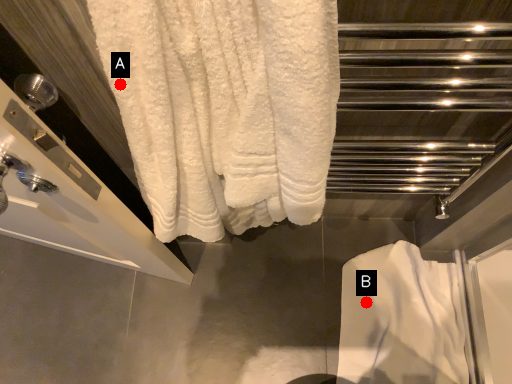
Question: Two points are circled on the image, labeled by A and B beside each circle. Which point appears closest to the camera in this image?

Choices:
 (A) A is closer
 (B) B is closer

Answer: (A)